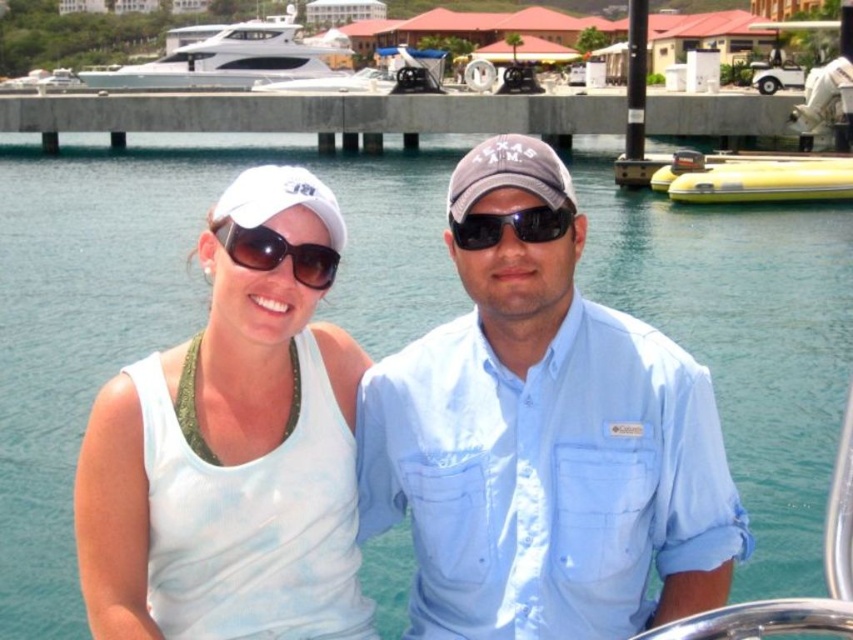
Question: Can you confirm if white glossy yacht at upper left is positioned above white fabric baseball cap at upper left?

Choices:
 (A) no
 (B) yes

Answer: (B)

Question: Which object is the closest to the light blue cotton shirt at center?

Choices:
 (A) white glossy yacht at upper left
 (B) white matte tank top at center
 (C) white fabric baseball cap at upper left

Answer: (B)

Question: Which object appears closest to the camera in this image?

Choices:
 (A) gray fabric baseball cap at center
 (B) sunglasses at center

Answer: (A)

Question: Can you confirm if concrete at center is positioned above white fabric baseball cap at upper left?

Choices:
 (A) no
 (B) yes

Answer: (B)

Question: Which point is farther to the camera?

Choices:
 (A) white matte tank top at center
 (B) black matte sunglasses at center
 (C) gray fabric baseball cap at center
 (D) white fabric baseball cap at upper left

Answer: (B)

Question: Can you confirm if concrete at center is positioned to the left of sunglasses at center?

Choices:
 (A) yes
 (B) no

Answer: (A)